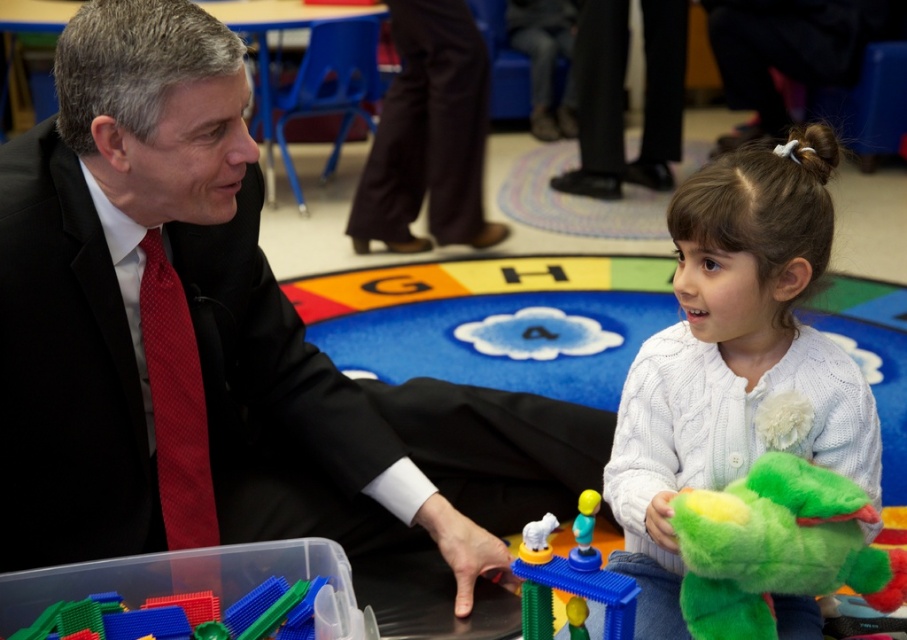
Question: Is smooth black suit at center further to camera compared to black smooth pants at center?

Choices:
 (A) yes
 (B) no

Answer: (B)

Question: Is white knitted sweater at center wider than translucent plastic blocks at lower left?

Choices:
 (A) no
 (B) yes

Answer: (B)

Question: Does smooth black suit at center have a lesser width compared to fluffy green plush toy at lower right?

Choices:
 (A) no
 (B) yes

Answer: (A)

Question: Which object appears farthest from the camera in this image?

Choices:
 (A) translucent plastic building block at center
 (B) white knitted sweater at center

Answer: (B)

Question: Which point is closer to the camera?

Choices:
 (A) translucent plastic blocks at lower left
 (B) fluffy green plush toy at lower right
 (C) white knitted sweater at center

Answer: (B)

Question: Which point appears closest to the camera in this image?

Choices:
 (A) (748, 228)
 (B) (414, 250)
 (C) (180, 608)

Answer: (A)